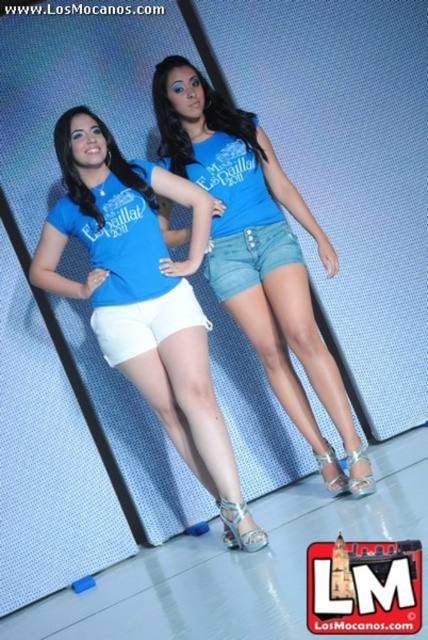
Question: Is matte blue denim shorts at center above matte blue t-shirt at center?

Choices:
 (A) no
 (B) yes

Answer: (B)

Question: Which of the following is the farthest from the observer?

Choices:
 (A) (282, 333)
 (B) (205, 218)

Answer: (A)

Question: Which point is closer to the camera?

Choices:
 (A) (306, 230)
 (B) (240, 531)

Answer: (B)

Question: Does matte blue denim shorts at center appear under matte blue t-shirt at center?

Choices:
 (A) no
 (B) yes

Answer: (A)

Question: Can you confirm if matte blue denim shorts at center is positioned to the left of matte blue t-shirt at center?

Choices:
 (A) no
 (B) yes

Answer: (A)